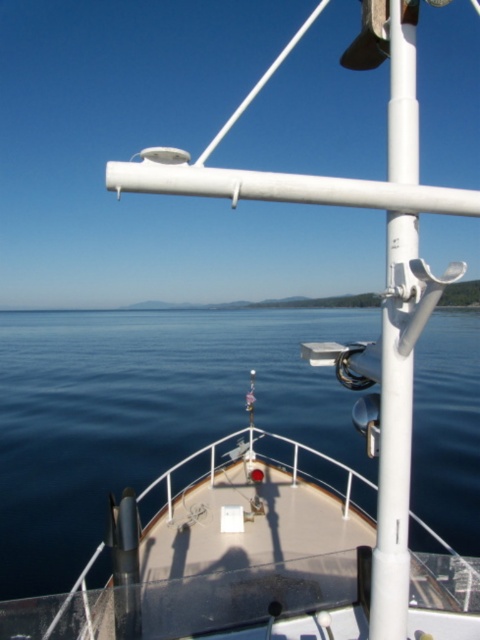
Is blue water at center bigger than white metallic pole at center-right?

Yes.

You are a GUI agent. You are given a task and a screenshot of the screen. Output one action in this format:
    pyautogui.click(x=<x>, y=<y>)
    Task: Click on the blue water at center
    This screenshot has height=640, width=480.
    Given the screenshot: What is the action you would take?
    pyautogui.click(x=143, y=412)

This screenshot has width=480, height=640. Identify the location of blue water at center. pos(143,412).